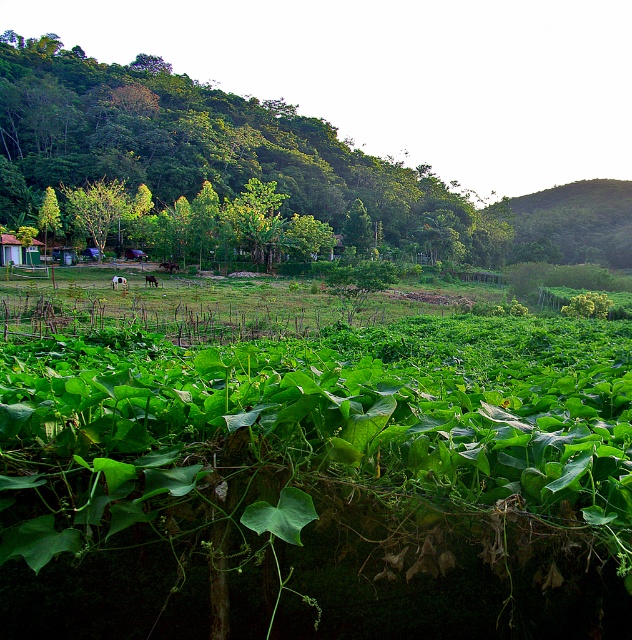
Which is below, green leafy tree at center or white woolly sheep at center?

white woolly sheep at center is below.

Image resolution: width=632 pixels, height=640 pixels. Find the location of `green leafy tree at center`. green leafy tree at center is located at coordinates (210, 150).

Is green leafy tree at center thinner than brown furry horse at center?

No, green leafy tree at center is not thinner than brown furry horse at center.

Can you confirm if green leafy tree at center is taller than brown furry horse at center?

Yes, green leafy tree at center is taller than brown furry horse at center.

Where is `green leafy tree at center`? green leafy tree at center is located at coordinates (210, 150).

Which is below, green leafy tree at center or green leafy hillside at upper right?

green leafy hillside at upper right is lower down.

Does green leafy tree at center have a greater height compared to green leafy hillside at upper right?

Indeed, green leafy tree at center has a greater height compared to green leafy hillside at upper right.

The width and height of the screenshot is (632, 640). Describe the element at coordinates (210, 150) in the screenshot. I see `green leafy tree at center` at that location.

Locate an element on the screen. This screenshot has width=632, height=640. green leafy tree at center is located at coordinates (210, 150).